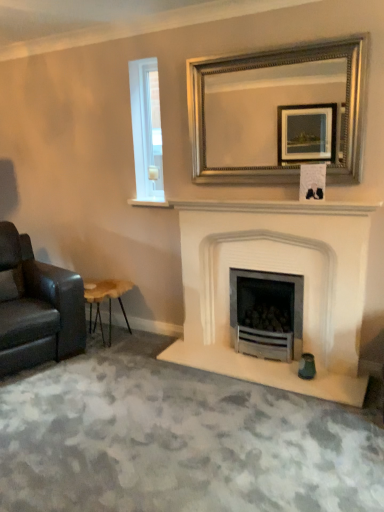
This screenshot has width=384, height=512. What do you see at coordinates (269, 66) in the screenshot?
I see `silver/golden metallic mirror at upper center` at bounding box center [269, 66].

Where is `leather couch at left`? This screenshot has width=384, height=512. leather couch at left is located at coordinates (38, 308).

Locate an element on the screen. This screenshot has height=512, width=384. white glass window at upper left is located at coordinates (146, 130).

Are leather couch at left and white marble fireplace at center located far from each other?

That's right, there is a large distance between leather couch at left and white marble fireplace at center.

Is leather couch at left not inside white marble fireplace at center?

Yes, leather couch at left is outside of white marble fireplace at center.

Does point (23, 285) lie behind point (368, 209)?

Yes, it is behind point (368, 209).

Considering the relative sizes of leather couch at left and white marble fireplace at center in the image provided, is leather couch at left bigger than white marble fireplace at center?

Indeed, leather couch at left has a larger size compared to white marble fireplace at center.

Is point (288, 202) farther from camera compared to point (324, 236)?

Yes, point (288, 202) is farther from viewer.

Is white marble fireplace at center inside or outside of white stone fireplace at center?

white marble fireplace at center cannot be found inside white stone fireplace at center.

Which of these two, white marble fireplace at center or white stone fireplace at center, stands shorter?

Standing shorter between the two is white marble fireplace at center.

Considering the sizes of objects white marble fireplace at center and white stone fireplace at center in the image provided, who is bigger, white marble fireplace at center or white stone fireplace at center?

white stone fireplace at center.

Can you see white stone fireplace at center touching white marble fireplace at center?

There is a gap between white stone fireplace at center and white marble fireplace at center.

From the picture: Is white stone fireplace at center turned away from white marble fireplace at center?

No.

Is white stone fireplace at center in front of or behind white marble fireplace at center in the image?

Clearly, white stone fireplace at center is in front of white marble fireplace at center.

Is white marble fireplace at center surrounded by white stone fireplace at center?

No, white marble fireplace at center is not a part of white stone fireplace at center.

Can you tell me how much silver/golden metallic mirror at upper center and white marble fireplace at center differ in facing direction?

The facing directions of silver/golden metallic mirror at upper center and white marble fireplace at center are 0.59 degrees apart.

From a real-world perspective, who is located higher, silver/golden metallic mirror at upper center or white marble fireplace at center?

From a 3D spatial view, silver/golden metallic mirror at upper center is above.

Between silver/golden metallic mirror at upper center and white marble fireplace at center, which one appears on the right side from the viewer's perspective?

Positioned to the right is silver/golden metallic mirror at upper center.

Find the location of `mirror located on the right of white marble fireplace at center`. mirror located on the right of white marble fireplace at center is located at coordinates (269, 66).

How distant is wooden stool at lower left from white marble fireplace at center?

wooden stool at lower left is 37.22 inches away from white marble fireplace at center.

From the image's perspective, is wooden stool at lower left above white marble fireplace at center?

No, from the image's perspective, wooden stool at lower left is not above white marble fireplace at center.

Is wooden stool at lower left looking in the opposite direction of white marble fireplace at center?

That's not correct — wooden stool at lower left is not looking away from white marble fireplace at center.

From a real-world perspective, between wooden stool at lower left and white marble fireplace at center, who is vertically lower?

wooden stool at lower left.

Consider the image. From the image's perspective, is white marble fireplace at center positioned above or below wooden stool at lower left?

white marble fireplace at center is above wooden stool at lower left.

Considering the sizes of objects white marble fireplace at center and wooden stool at lower left in the image provided, who is shorter, white marble fireplace at center or wooden stool at lower left?

With less height is white marble fireplace at center.

Looking at the image, does white marble fireplace at center seem bigger or smaller compared to wooden stool at lower left?

Clearly, white marble fireplace at center is smaller in size than wooden stool at lower left.

Looking at this image, from a real-world perspective, is white marble fireplace at center on silver/golden metallic mirror at upper center?

No, from a real-world perspective, white marble fireplace at center is not on top of silver/golden metallic mirror at upper center.

Is white marble fireplace at center inside or outside of silver/golden metallic mirror at upper center?

white marble fireplace at center is located beyond the bounds of silver/golden metallic mirror at upper center.

From the image's perspective, relative to silver/golden metallic mirror at upper center, is white marble fireplace at center above or below?

Clearly, from the image's perspective, white marble fireplace at center is below silver/golden metallic mirror at upper center.

Between white marble fireplace at center and silver/golden metallic mirror at upper center, which one has larger size?

With larger size is silver/golden metallic mirror at upper center.

In order to click on chair behind the white marble fireplace at center in this screenshot , I will do coord(38,308).

At what (x,y) coordinates should I click in order to perform the action: click on fireplace that is below the white marble fireplace at center (from the image's perspective). Please return your answer as a coordinate pair (x, y). Image resolution: width=384 pixels, height=512 pixels. Looking at the image, I should click on (283, 272).

Based on their spatial positions, is leather couch at left or white stone fireplace at center closer to silver/golden metallic mirror at upper center?

Among the two, white stone fireplace at center is located nearer to silver/golden metallic mirror at upper center.

Looking at the image, which one is located further to white marble fireplace at center, silver/golden metallic mirror at upper center or wooden stool at lower left?

wooden stool at lower left lies further to white marble fireplace at center than the other object.

Looking at the image, which one is located further to silver/golden metallic mirror at upper center, white stone fireplace at center or wooden stool at lower left?

wooden stool at lower left.

From the image, which object appears to be nearer to silver/golden metallic mirror at upper center, white marble fireplace at center or white glass window at upper left?

white marble fireplace at center lies closer to silver/golden metallic mirror at upper center than the other object.

From the image, which object appears to be farther from white stone fireplace at center, white marble fireplace at center or silver/golden metallic mirror at upper center?

Among the two, silver/golden metallic mirror at upper center is located further to white stone fireplace at center.

Looking at the image, which one is located further to leather couch at left, white glass window at upper left or wooden stool at lower left?

The object further to leather couch at left is white glass window at upper left.

Estimate the real-world distances between objects in this image. Which object is closer to silver/golden metallic mirror at upper center, leather couch at left or white marble fireplace at center?

white marble fireplace at center is positioned closer to the anchor silver/golden metallic mirror at upper center.

Based on their spatial positions, is wooden stool at lower left or silver/golden metallic mirror at upper center closer to leather couch at left?

The object closer to leather couch at left is wooden stool at lower left.

At what (x,y) coordinates should I click in order to perform the action: click on mantle between leather couch at left and silver/golden metallic mirror at upper center in the horizontal direction. Please return your answer as a coordinate pair (x, y). This screenshot has height=512, width=384. Looking at the image, I should click on (265, 207).

The width and height of the screenshot is (384, 512). What are the coordinates of `mantle that lies between white glass window at upper left and wooden stool at lower left from top to bottom` in the screenshot? It's located at (265, 207).

This screenshot has width=384, height=512. Identify the location of mirror between white glass window at upper left and wooden stool at lower left from top to bottom. (269, 66).

Image resolution: width=384 pixels, height=512 pixels. I want to click on fireplace between wooden stool at lower left and silver/golden metallic mirror at upper center, so click(x=283, y=272).